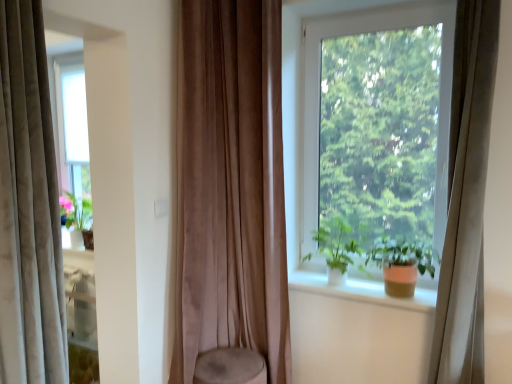
Question: From the image's perspective, is matte orange pot at window located above or below transparent glass window at center?

Choices:
 (A) below
 (B) above

Answer: (A)

Question: From a real-world perspective, is matte orange pot at window physically located above or below transparent glass window at center?

Choices:
 (A) above
 (B) below

Answer: (B)

Question: Based on their relative distances, which object is farther from the transparent glass window at center?

Choices:
 (A) white smooth window sill at center
 (B) matte orange pot at window
 (C) suede-like brown curtain at center, the second curtain viewed from the right
 (D) velvet beige curtain at left, the 1th curtain from the left
 (E) beige velvet curtain at right, which is the third curtain in left-to-right order

Answer: (D)

Question: Which is nearer to the suede-like brown curtain at center, the second curtain viewed from the right?

Choices:
 (A) beige velvet curtain at right, which is the third curtain in left-to-right order
 (B) velvet beige curtain at left, the 1th curtain from the left
 (C) white smooth window sill at center
 (D) transparent glass window at center
 (E) matte orange pot at window

Answer: (D)